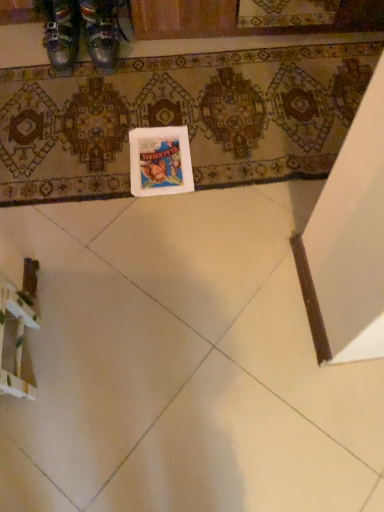
The image size is (384, 512). I want to click on vacant point to the right of metallic leather shoes at upper left, the 1th footwear from the right, so click(151, 57).